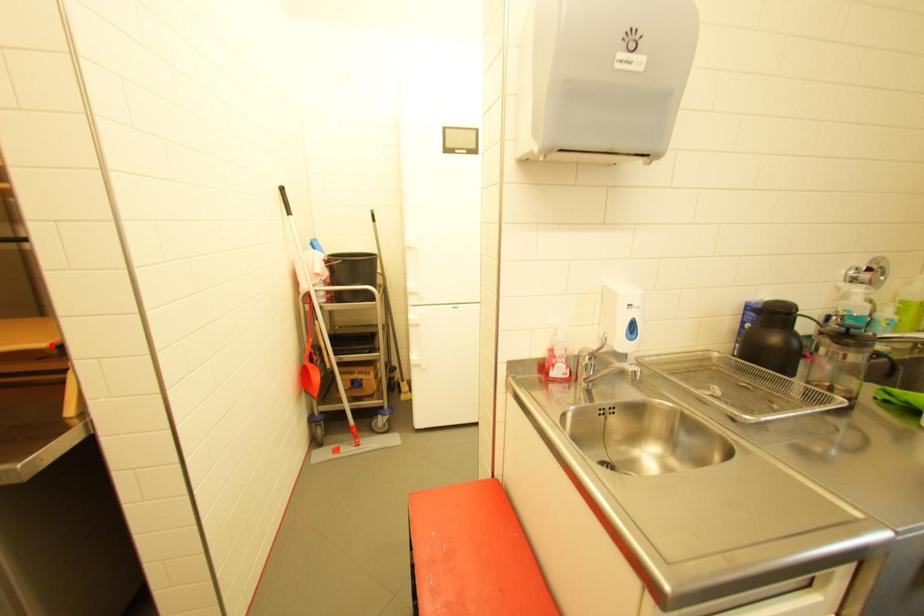
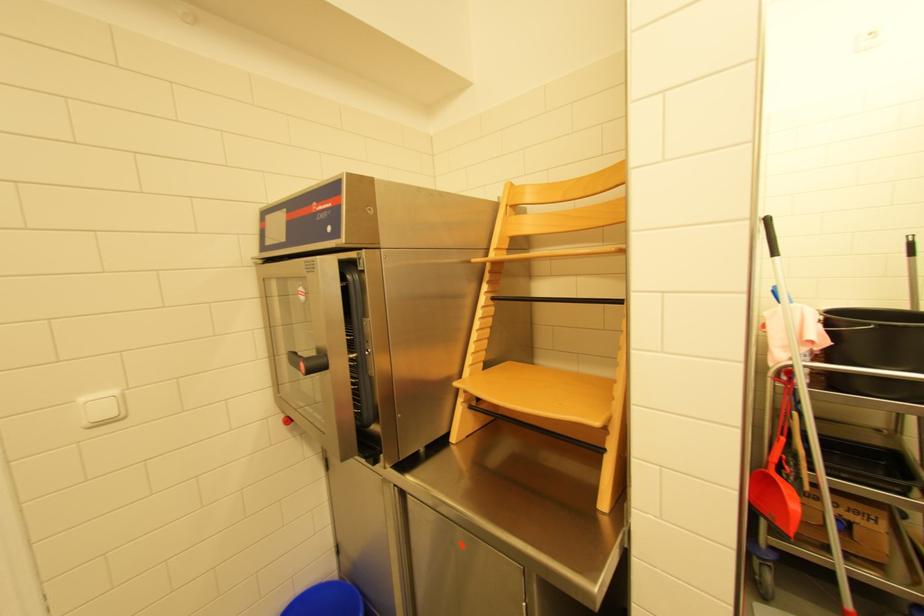
The point at the highlighted location is marked in the first image. Where is the corresponding point in the second image?

(603, 424)